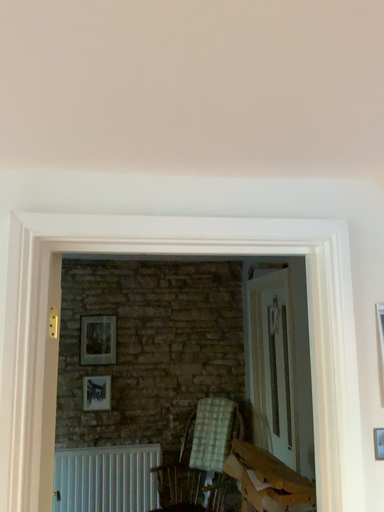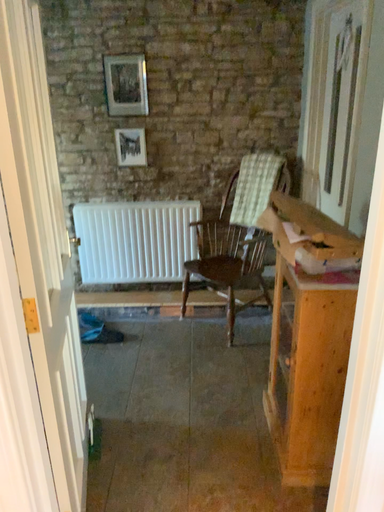
Question: How did the camera likely rotate when shooting the video?

Choices:
 (A) rotated upward
 (B) rotated downward

Answer: (B)